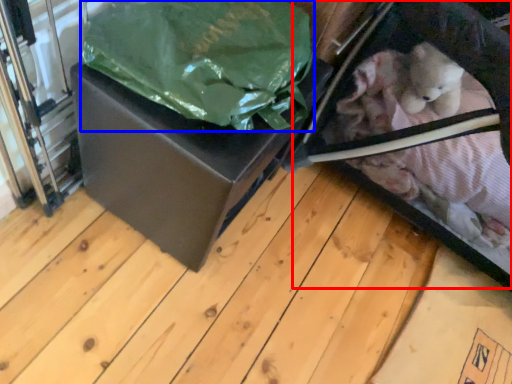
Question: Which object appears farthest to the camera in this image, baby carriage (highlighted by a red box) or plastic bag (highlighted by a blue box)?

Choices:
 (A) baby carriage
 (B) plastic bag

Answer: (A)